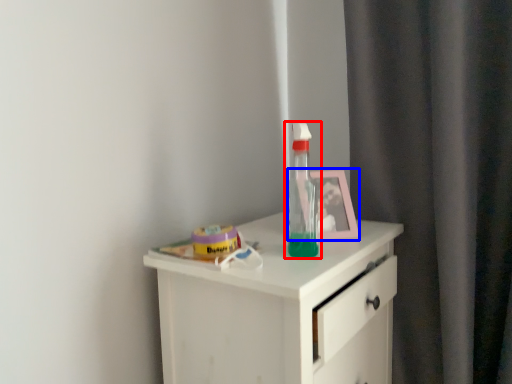
Question: Which object appears farthest to the camera in this image, bottle (highlighted by a red box) or picture frame (highlighted by a blue box)?

Choices:
 (A) bottle
 (B) picture frame

Answer: (B)